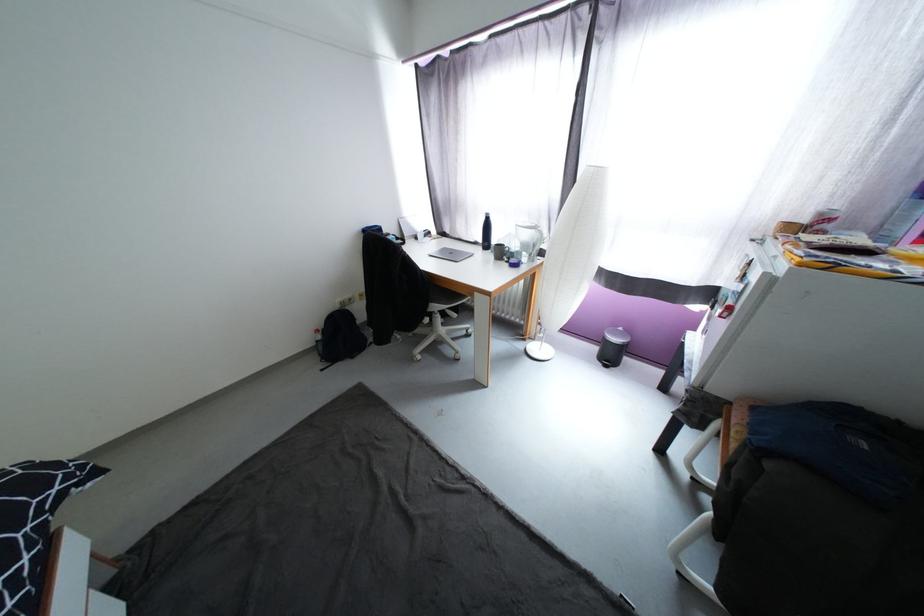
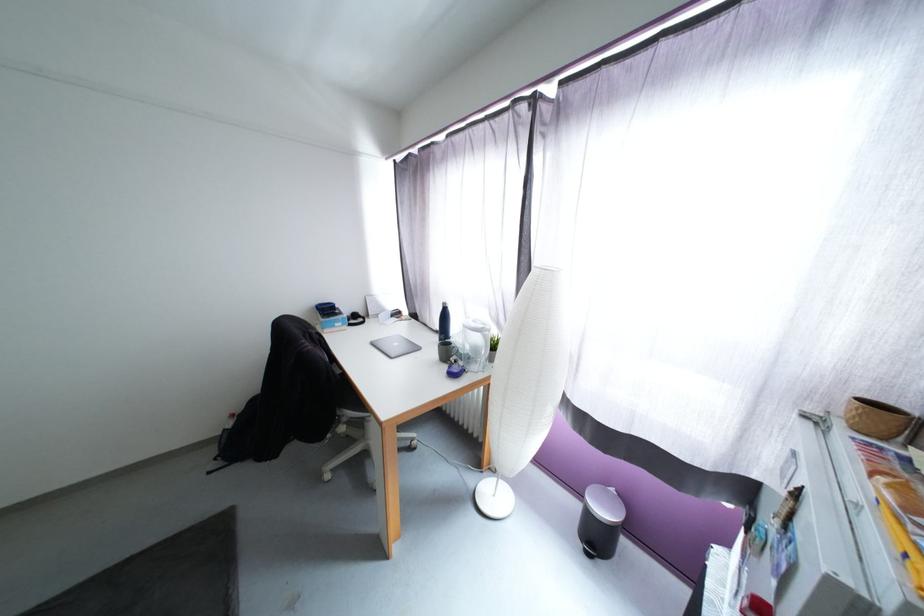
In a continuous first-person perspective shot, in which direction is the camera moving?

The cameraman walked toward right, forward.